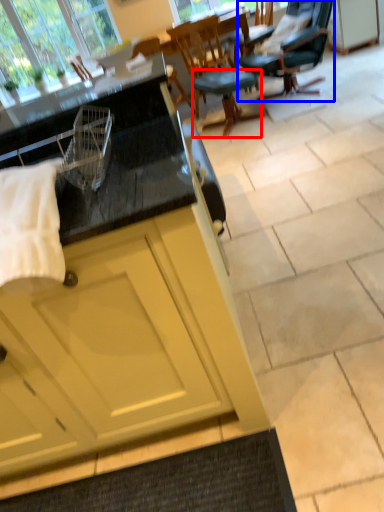
Question: Which object is closer to the camera taking this photo, stool (highlighted by a red box) or chair (highlighted by a blue box)?

Choices:
 (A) stool
 (B) chair

Answer: (B)